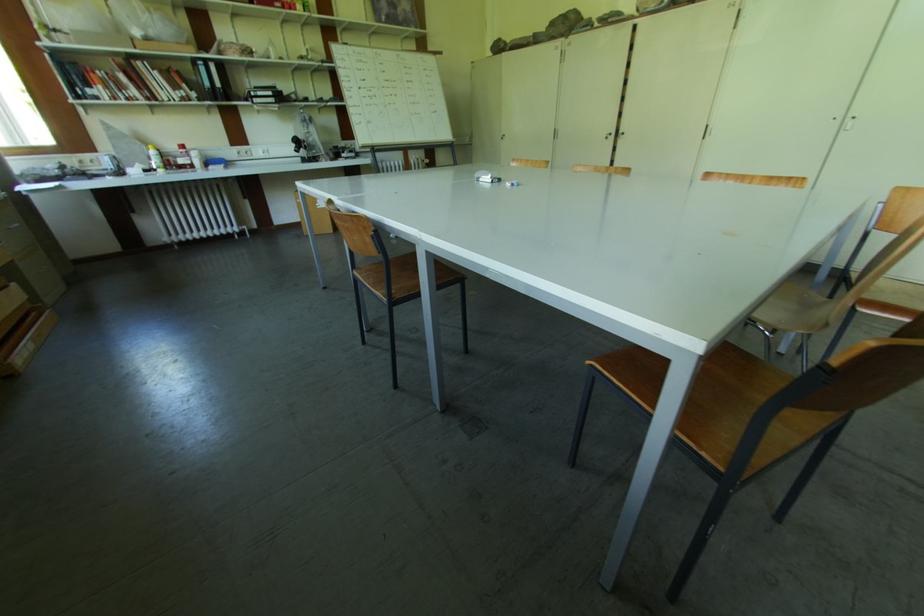
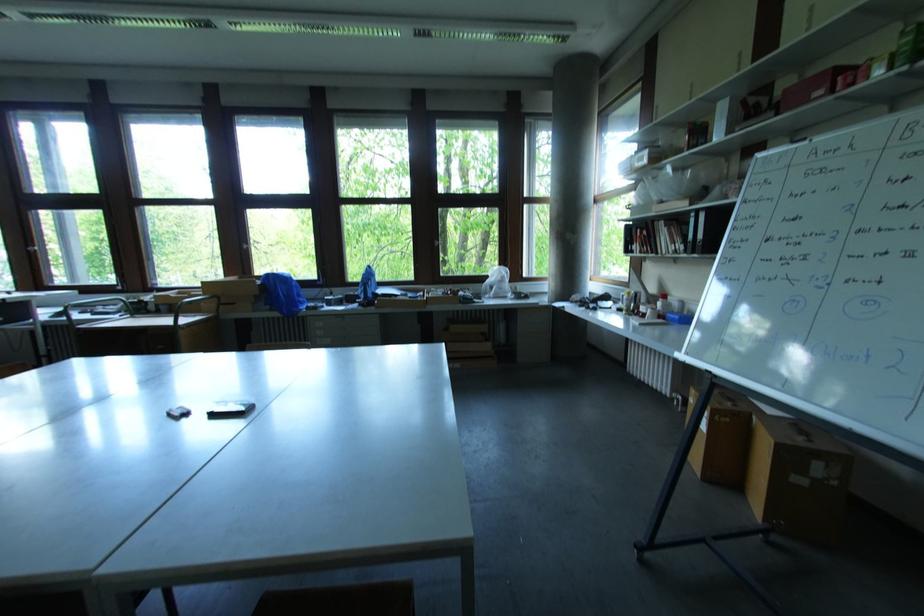
Where in the second image is the point corresponding to point (186, 148) from the first image?

(667, 298)